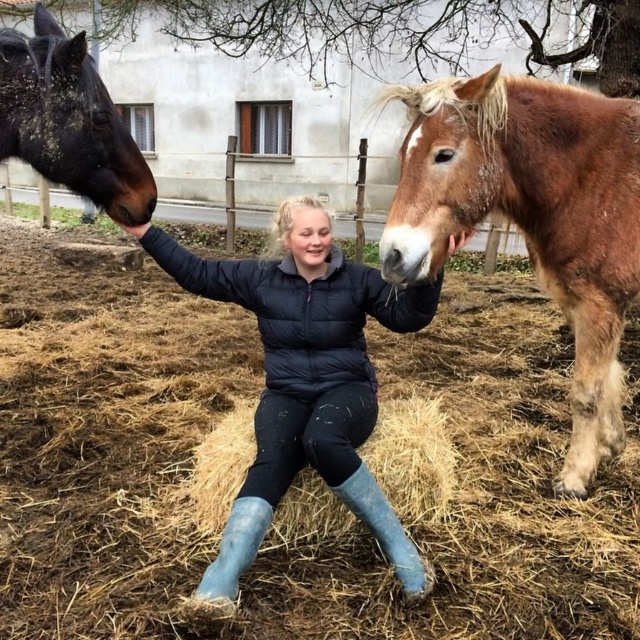
Question: Which of the following is the farthest from the observer?

Choices:
 (A) (268, 500)
 (B) (390, 433)
 (C) (484, 328)
 (D) (445, 209)

Answer: (C)

Question: Does shiny black horse at left appear over light brown straw at center?

Choices:
 (A) yes
 (B) no

Answer: (A)

Question: Considering the relative positions of brown fuzzy horse at upper right and black matte jacket at center in the image provided, where is brown fuzzy horse at upper right located with respect to black matte jacket at center?

Choices:
 (A) below
 (B) above

Answer: (B)

Question: Can you confirm if brown dry hay at center is bigger than black matte jacket at center?

Choices:
 (A) no
 (B) yes

Answer: (A)

Question: Which point is closer to the camera?

Choices:
 (A) (150, 172)
 (B) (253, 291)
 (C) (317, 525)

Answer: (A)

Question: Which point is farther to the camera?

Choices:
 (A) (376, 445)
 (B) (616, 163)

Answer: (B)